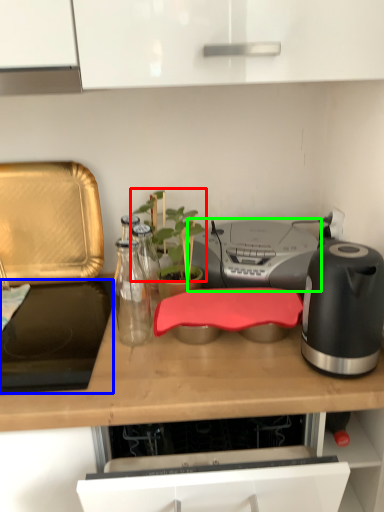
Question: Based on their relative distances, which object is nearer to plant (highlighted by a red box)? Choose from gas stove (highlighted by a blue box) and stereo (highlighted by a green box).

Choices:
 (A) gas stove
 (B) stereo

Answer: (B)